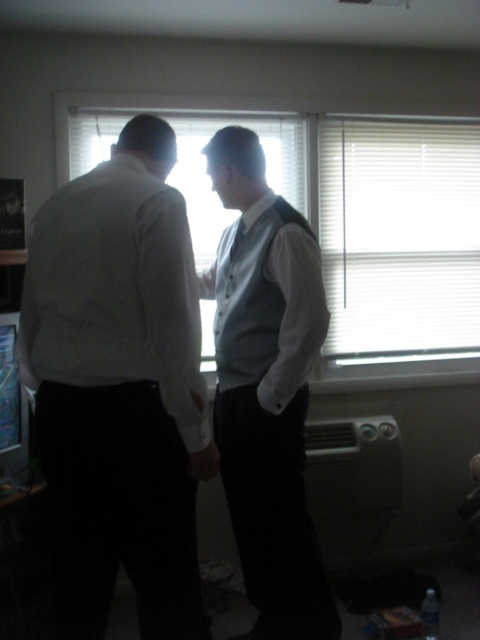
Question: Can you confirm if white blinds at upper center is wider than silky white tie at center?

Choices:
 (A) no
 (B) yes

Answer: (B)

Question: Is white matte vest at center thinner than white blinds at upper center?

Choices:
 (A) no
 (B) yes

Answer: (B)

Question: Can you confirm if white matte vest at center is wider than white blinds at upper center?

Choices:
 (A) no
 (B) yes

Answer: (A)

Question: Based on their relative distances, which object is farther from the matte white shirt at left?

Choices:
 (A) white matte vest at center
 (B) silky white tie at center

Answer: (B)

Question: Which object appears farthest from the camera in this image?

Choices:
 (A) silky white tie at center
 (B) white matte vest at center
 (C) matte white shirt at left

Answer: (A)

Question: Which object appears farthest from the camera in this image?

Choices:
 (A) white blinds at upper center
 (B) gray fabric vest at center
 (C) matte white shirt at left
 (D) silky white tie at center

Answer: (A)